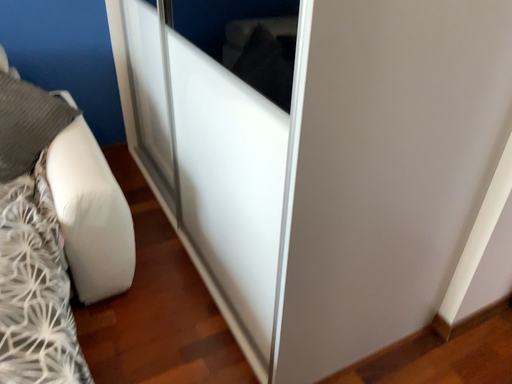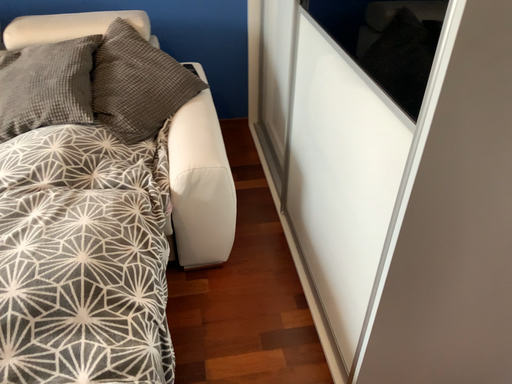
Question: How did the camera likely rotate when shooting the video?

Choices:
 (A) rotated left
 (B) rotated right

Answer: (A)